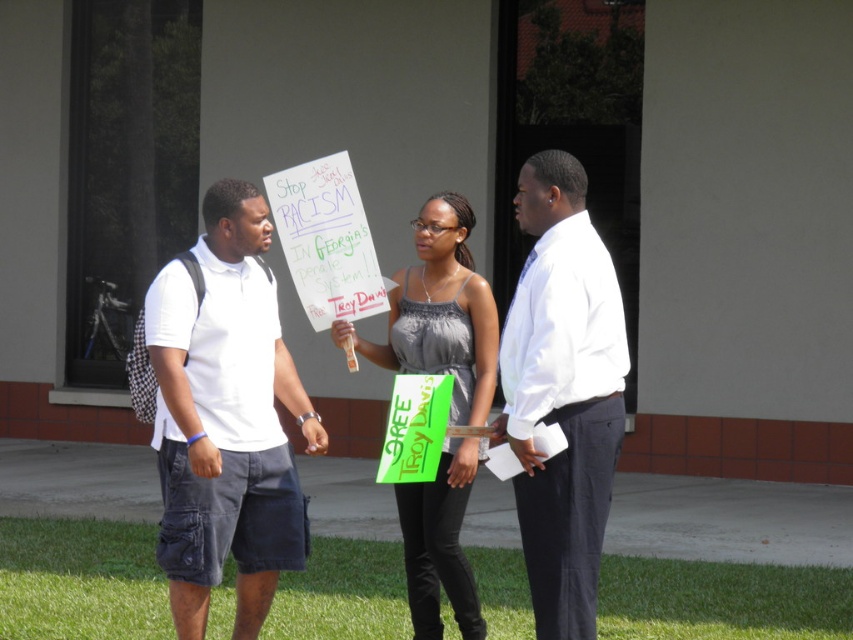
Who is lower down, white cotton polo shirt at left or white smooth shirt at center?

white cotton polo shirt at left

What do you see at coordinates (225, 419) in the screenshot? I see `white cotton polo shirt at left` at bounding box center [225, 419].

You are a GUI agent. You are given a task and a screenshot of the screen. Output one action in this format:
    pyautogui.click(x=<x>, y=<y>)
    Task: Click on the white cotton polo shirt at left
    The width and height of the screenshot is (853, 640).
    Given the screenshot: What is the action you would take?
    pyautogui.click(x=225, y=419)

This screenshot has height=640, width=853. Identify the location of white cotton polo shirt at left. (225, 419).

Is white paper sign at center below white cotton polo shirt at left?

Yes, white paper sign at center is below white cotton polo shirt at left.

Is point (444, 552) positioned before point (286, 384)?

Yes.

Locate an element on the screen. The height and width of the screenshot is (640, 853). white paper sign at center is located at coordinates (524, 364).

Between white smooth shirt at center and matte gray tank top at center, which one has less height?

white smooth shirt at center is shorter.

Looking at this image, is white smooth shirt at center above matte gray tank top at center?

Correct, white smooth shirt at center is located above matte gray tank top at center.

Describe the element at coordinates (561, 392) in the screenshot. I see `white smooth shirt at center` at that location.

At what (x,y) coordinates should I click in order to perform the action: click on white smooth shirt at center. Please return your answer as a coordinate pair (x, y). The image size is (853, 640). Looking at the image, I should click on (561, 392).